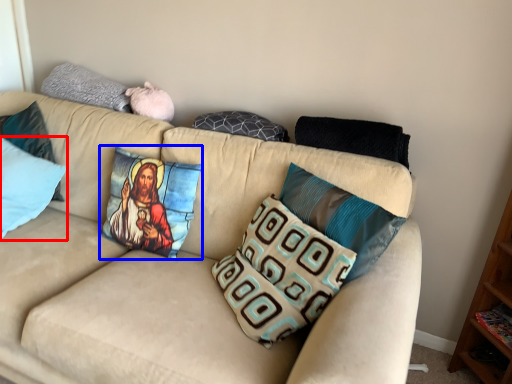
Question: Which of the following is the farthest to the observer, pillow (highlighted by a red box) or pillow (highlighted by a blue box)?

Choices:
 (A) pillow
 (B) pillow

Answer: (A)